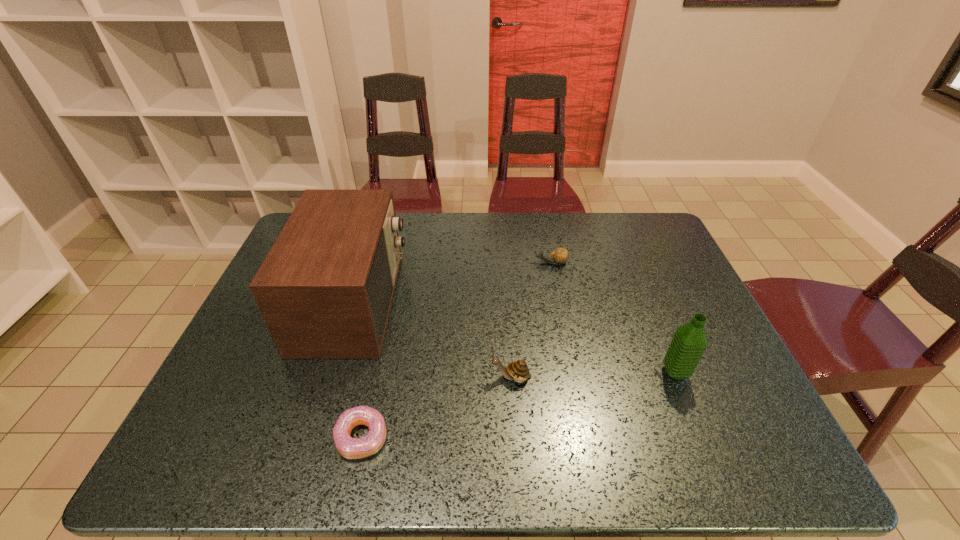
In order to click on vacant space that satisfies the following two spatial constraints: 1. on the front-facing side of the farther escargot; 2. on the front side of the nearest object in this screenshot , I will do `click(585, 437)`.

Find the location of a particular element. The height and width of the screenshot is (540, 960). vacant area in the image that satisfies the following two spatial constraints: 1. on the front-facing side of the rightmost object; 2. on the left side of the right escargot is located at coordinates (572, 373).